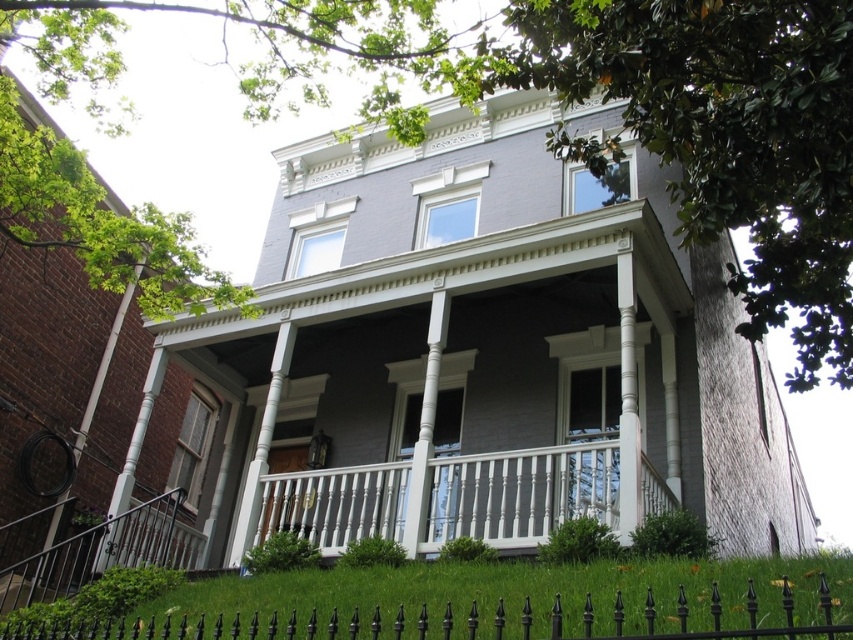
You are standing in front of the residential building and want to determine the relative positions of two points marked on the facade. The first point is at coordinates point (445,532) and the second is at point (822,627). Which point is closer to you?

Point (445,532) is closer to you because it is further to the viewer than point (822,627).

You are standing at the entrance of the building and want to locate the white painted wood porch at center. Based on the coordinates provided, can you determine its exact location relative to your current position?

The white painted wood porch at center is located at coordinates point (450, 497), which means it is positioned to the right and slightly above your current position at the entrance.

You are a delivery person trying to reach the entrance door of the house. You are currently standing outside the black wrought iron fence at lower center. Which direction should you move to first to approach the white painted wood porch at center?

The white painted wood porch at center is located above the black wrought iron fence at lower center, so you should move forward towards the house to reach the porch.